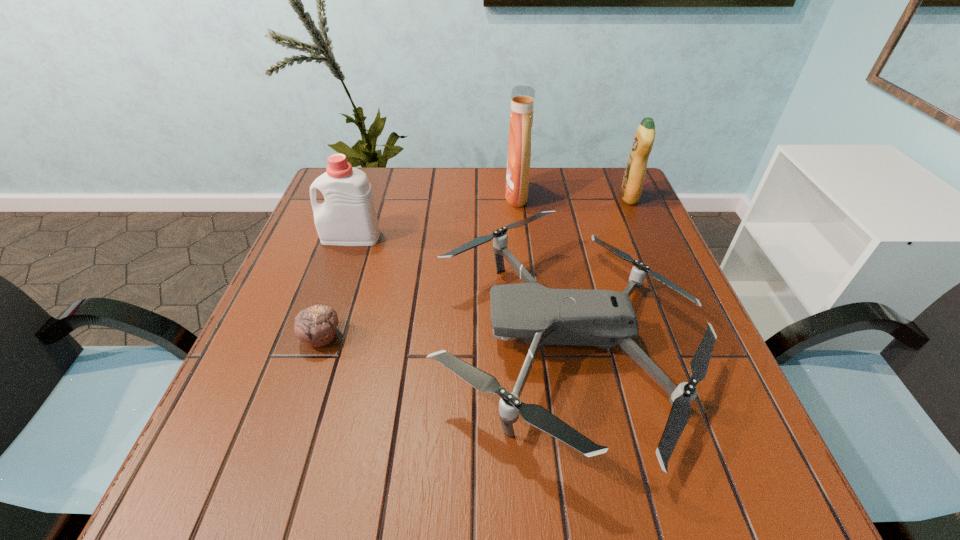
Find the location of `the tallest object`. the tallest object is located at coordinates pos(522,97).

At what (x,y) coordinates should I click in order to perform the action: click on the second detergent from right to left. Please return your answer as a coordinate pair (x, y). The width and height of the screenshot is (960, 540). Looking at the image, I should click on point(522,97).

Where is `the rightmost detergent`? the rightmost detergent is located at coordinates (631, 187).

Where is `the nearest detergent`? The width and height of the screenshot is (960, 540). the nearest detergent is located at coordinates (348, 217).

Image resolution: width=960 pixels, height=540 pixels. I want to click on the leftmost detergent, so click(348, 217).

At what (x,y) coordinates should I click in order to perform the action: click on the second shortest object. Please return your answer as a coordinate pair (x, y). The image size is (960, 540). Looking at the image, I should click on (604, 318).

You are a GUI agent. You are given a task and a screenshot of the screen. Output one action in this format:
    pyautogui.click(x=<x>, y=<y>)
    Task: Click on the shortest object
    This screenshot has width=960, height=540.
    Given the screenshot: What is the action you would take?
    pyautogui.click(x=316, y=326)

The width and height of the screenshot is (960, 540). What are the coordinates of `free spot located 0.340m on the front-facing side of the tallest detergent` in the screenshot? It's located at tap(384, 196).

This screenshot has height=540, width=960. Identify the location of vacant region located 0.290m on the front-facing side of the tallest detergent. (401, 196).

Where is `free space located 0.120m on the front-facing side of the tallest detergent`? The width and height of the screenshot is (960, 540). free space located 0.120m on the front-facing side of the tallest detergent is located at coordinates (463, 196).